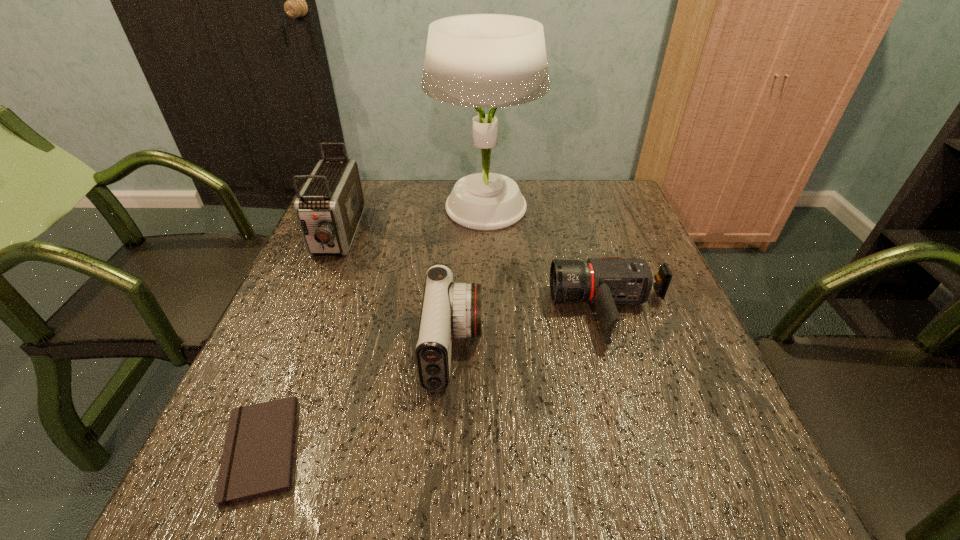
Find the location of a particular element. This screenshot has height=540, width=960. free space at the far right corner of the desktop is located at coordinates (611, 190).

Identify the location of free space at the near right corner of the desktop. click(760, 497).

Find the location of a particular element. The width and height of the screenshot is (960, 540). free point between the second camcorder from right to left and the leftmost camcorder is located at coordinates (396, 292).

I want to click on vacant area between the checkbook and the farthest camcorder, so click(x=300, y=342).

At what (x,y) coordinates should I click in order to perform the action: click on vacant space in between the lamp and the tallest camcorder. Please return your answer as a coordinate pair (x, y). Looking at the image, I should click on (411, 221).

You are a GUI agent. You are given a task and a screenshot of the screen. Output one action in this format:
    pyautogui.click(x=<x>, y=<y>)
    Task: Click on the free spot between the third tallest object and the tallest object
    This screenshot has height=540, width=960.
    Given the screenshot: What is the action you would take?
    pyautogui.click(x=469, y=278)

The width and height of the screenshot is (960, 540). In order to click on free space between the leftmost camcorder and the lamp in this screenshot , I will do `click(411, 221)`.

The width and height of the screenshot is (960, 540). Identify the location of empty space that is in between the lamp and the farthest camcorder. click(411, 221).

Identify the location of empty space that is in between the tallest camcorder and the second shortest camcorder. (396, 292).

Locate an element on the screen. The width and height of the screenshot is (960, 540). vacant point located between the lamp and the nearest object is located at coordinates (373, 328).